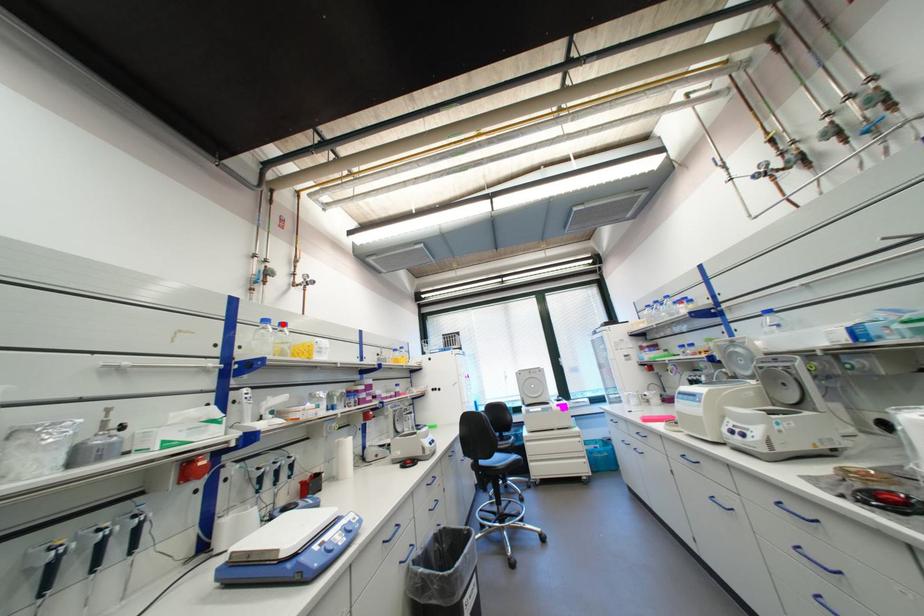
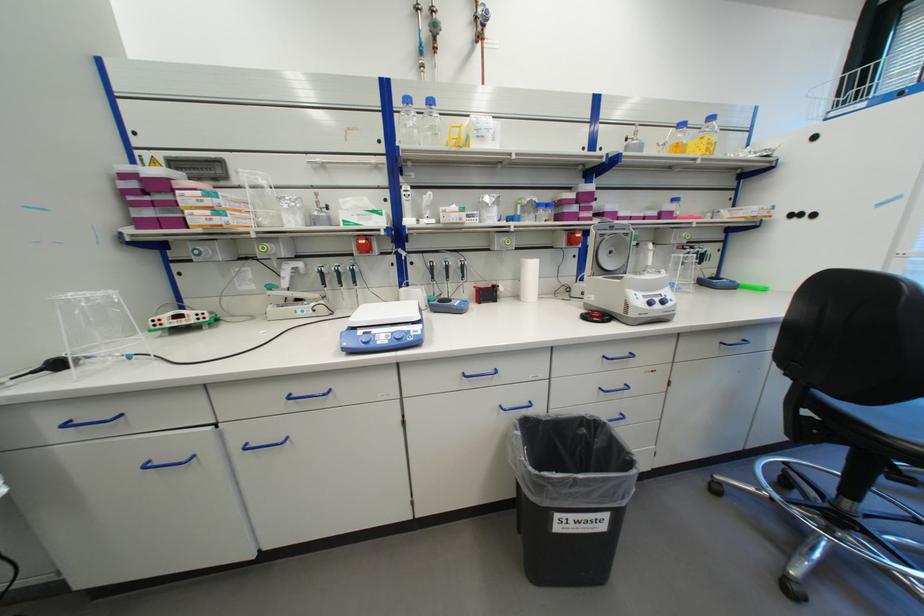
Question: A red point is marked in image1. In image2, is the corresponding 3D point closer to the camera or farther? Reply with the corresponding letter.

Choices:
 (A) The corresponding 3D point is closer.
 (B) The corresponding 3D point is farther.

Answer: (A)